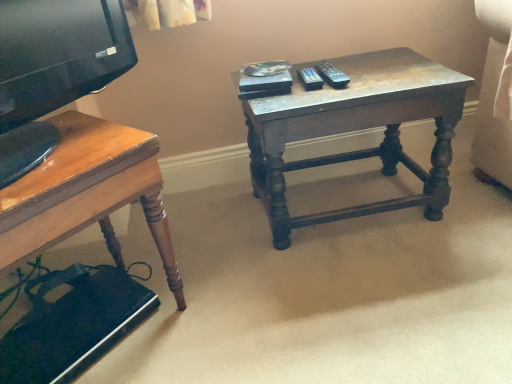
Question: Considering the relative positions of wooden desk at lower left and distressed wood table at center in the image provided, is wooden desk at lower left to the right of distressed wood table at center from the viewer's perspective?

Choices:
 (A) yes
 (B) no

Answer: (B)

Question: Are wooden desk at lower left and distressed wood table at center located far from each other?

Choices:
 (A) yes
 (B) no

Answer: (B)

Question: Is wooden desk at lower left closer to the viewer compared to distressed wood table at center?

Choices:
 (A) no
 (B) yes

Answer: (B)

Question: Is distressed wood table at center at the back of wooden desk at lower left?

Choices:
 (A) no
 (B) yes

Answer: (A)

Question: Is wooden desk at lower left directly adjacent to distressed wood table at center?

Choices:
 (A) no
 (B) yes

Answer: (A)

Question: From a real-world perspective, is wooden desk at lower left positioned over distressed wood table at center based on gravity?

Choices:
 (A) yes
 (B) no

Answer: (A)

Question: Is distressed wood table at center to the right of wooden desk at lower left from the viewer's perspective?

Choices:
 (A) no
 (B) yes

Answer: (B)

Question: Is distressed wood table at center not near wooden desk at lower left?

Choices:
 (A) yes
 (B) no

Answer: (B)

Question: Is distressed wood table at center oriented away from wooden desk at lower left?

Choices:
 (A) no
 (B) yes

Answer: (A)

Question: Does distressed wood table at center have a lesser width compared to wooden desk at lower left?

Choices:
 (A) yes
 (B) no

Answer: (A)

Question: From a real-world perspective, is distressed wood table at center positioned over wooden desk at lower left based on gravity?

Choices:
 (A) yes
 (B) no

Answer: (B)

Question: Is distressed wood table at center positioned beyond the bounds of wooden desk at lower left?

Choices:
 (A) yes
 (B) no

Answer: (A)

Question: From the image's perspective, relative to distressed wood table at center, is wooden desk at lower left above or below?

Choices:
 (A) below
 (B) above

Answer: (A)